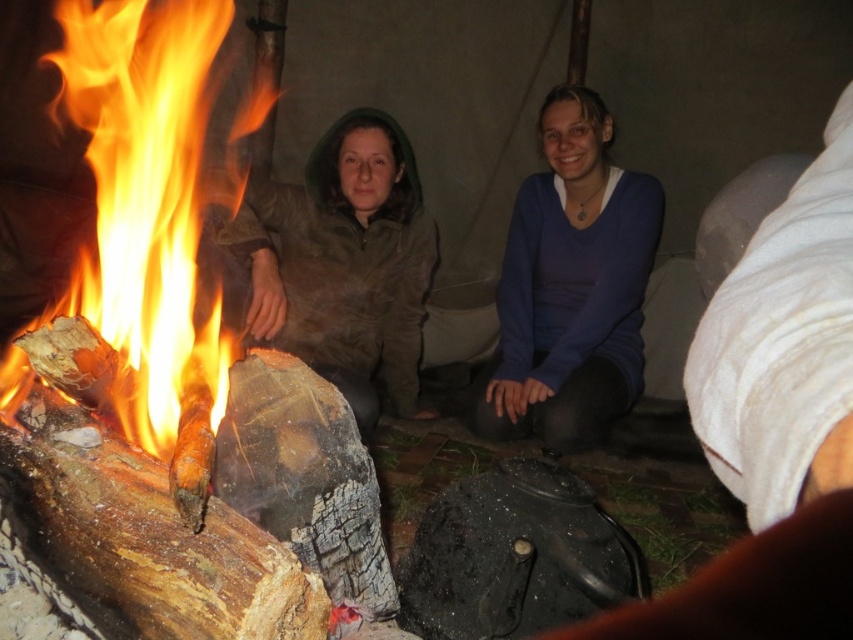
You are planning to take a photo of the charcoal wood fire at left and the green matte jacket at center. Which object should you focus on first if you want to capture both in a single frame without moving the camera?

The charcoal wood fire at left is much taller than the green matte jacket at center, so you should focus on the charcoal wood fire at left first to ensure its height is properly framed before adjusting for the green matte jacket at center.

You are standing at the fire and want to move to the point that is closer to you. Which point should you go to, point (160, 177) or point (421, 259)?

Point (160, 177) is in front of point (421, 259), so you should go to point (160, 177) as it is closer to you.